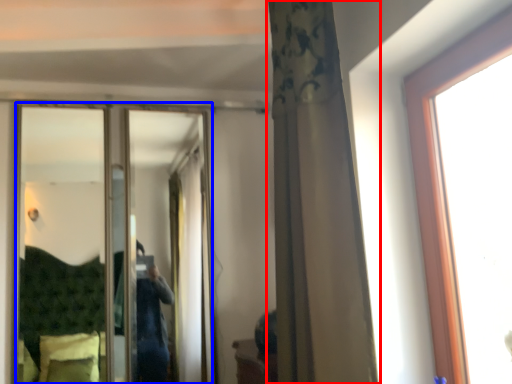
Question: Which point is further to the camera, curtain (highlighted by a red box) or mirror (highlighted by a blue box)?

Choices:
 (A) curtain
 (B) mirror

Answer: (B)